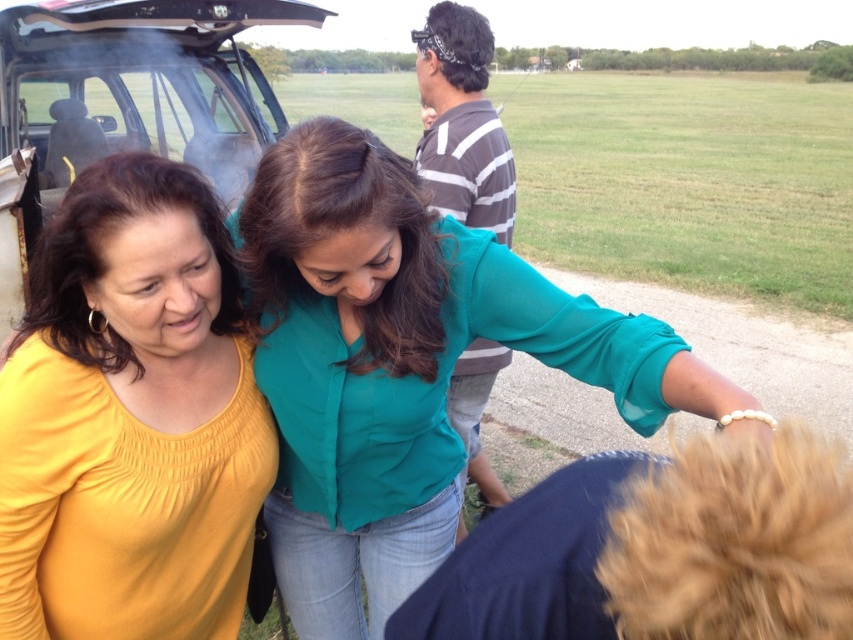
Between metallic silver car at upper left and striped cotton shirt at center, which one has less height?

striped cotton shirt at center

Between metallic silver car at upper left and striped cotton shirt at center, which one appears on the left side from the viewer's perspective?

From the viewer's perspective, metallic silver car at upper left appears more on the left side.

Looking at this image, who is more distant from viewer, (28,216) or (432,17)?

Positioned behind is point (432,17).

At what (x,y) coordinates should I click in order to perform the action: click on metallic silver car at upper left. Please return your answer as a coordinate pair (x, y). Looking at the image, I should click on (125, 100).

Can you confirm if teal satin blouse at center is wider than striped cotton shirt at center?

Yes.

Can you confirm if teal satin blouse at center is positioned to the right of striped cotton shirt at center?

No, teal satin blouse at center is not to the right of striped cotton shirt at center.

Where is `teal satin blouse at center`? This screenshot has width=853, height=640. teal satin blouse at center is located at coordinates (401, 365).

Who is higher up, teal satin blouse at center or yellow matte shirt at left?

Positioned higher is yellow matte shirt at left.

Which is more to the left, teal satin blouse at center or yellow matte shirt at left?

Positioned to the left is yellow matte shirt at left.

The height and width of the screenshot is (640, 853). What are the coordinates of `teal satin blouse at center` in the screenshot? It's located at (401, 365).